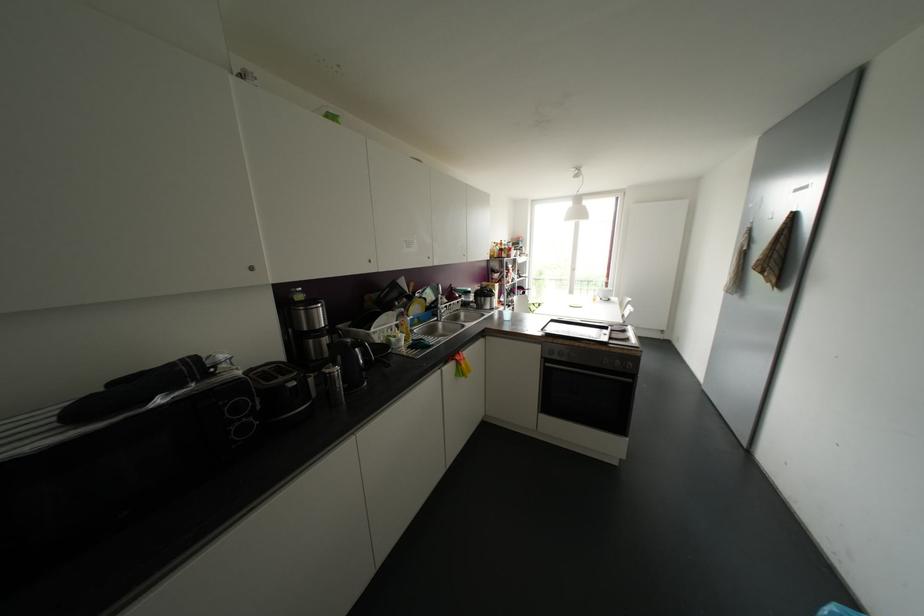
You are a GUI agent. You are given a task and a screenshot of the screen. Output one action in this format:
    pyautogui.click(x=<x>, y=<y>)
    Task: Click on the white coffee cup
    
    Given the screenshot: What is the action you would take?
    pyautogui.click(x=603, y=294)